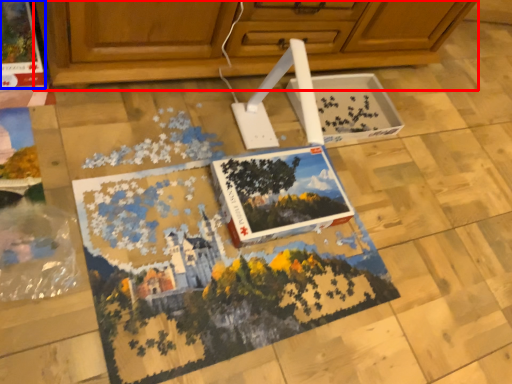
Question: Which object is further to the camera taking this photo, cabinetry (highlighted by a red box) or magazine (highlighted by a blue box)?

Choices:
 (A) cabinetry
 (B) magazine

Answer: (B)